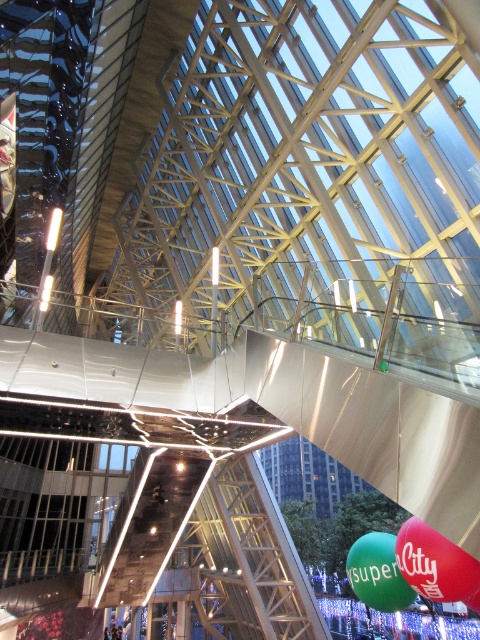
Who is positioned more to the left, matte red balloon at lower right or green rubber balloon at lower right?

green rubber balloon at lower right is more to the left.

Measure the distance from matte red balloon at lower right to green rubber balloon at lower right.

Result: 6.25 feet

Between point (427, 529) and point (411, 595), which one is positioned behind?

The point (411, 595) is more distant.

The height and width of the screenshot is (640, 480). I want to click on matte red balloon at lower right, so coord(434,563).